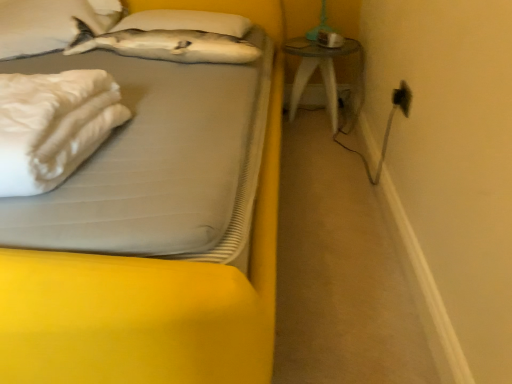
Question: Can you confirm if white matte pillow at upper left, which is counted as the 2th pillow, starting from the right, is smaller than white soft bed at upper left?

Choices:
 (A) no
 (B) yes

Answer: (B)

Question: Is white matte pillow at upper left, which is counted as the 2th pillow, starting from the right, taller than white soft bed at upper left?

Choices:
 (A) yes
 (B) no

Answer: (B)

Question: Would you say white soft bed at upper left is part of white matte pillow at upper left, marked as the 1th pillow in a left-to-right arrangement,'s contents?

Choices:
 (A) yes
 (B) no

Answer: (B)

Question: From a real-world perspective, is white matte pillow at upper left, marked as the 1th pillow in a left-to-right arrangement, physically above white soft bed at upper left?

Choices:
 (A) yes
 (B) no

Answer: (A)

Question: Is white matte pillow at upper left, marked as the 1th pillow in a left-to-right arrangement, wider than white soft bed at upper left?

Choices:
 (A) yes
 (B) no

Answer: (B)

Question: Is white matte pillow at upper left, which is counted as the 2th pillow, starting from the right, behind white soft bed at upper left?

Choices:
 (A) no
 (B) yes

Answer: (B)

Question: Are white matte pillow at upper left, which is counted as the 2th pillow, starting from the right, and white soft pillow at upper center, marked as the 1th pillow in a right-to-left arrangement, far apart?

Choices:
 (A) yes
 (B) no

Answer: (B)

Question: Does white matte pillow at upper left, which is counted as the 2th pillow, starting from the right, have a smaller size compared to white soft pillow at upper center, marked as the 1th pillow in a right-to-left arrangement?

Choices:
 (A) yes
 (B) no

Answer: (B)

Question: Considering the relative positions of white matte pillow at upper left, marked as the 1th pillow in a left-to-right arrangement, and white soft pillow at upper center, marked as the 1th pillow in a right-to-left arrangement, in the image provided, is white matte pillow at upper left, marked as the 1th pillow in a left-to-right arrangement, in front of white soft pillow at upper center, marked as the 1th pillow in a right-to-left arrangement,?

Choices:
 (A) no
 (B) yes

Answer: (B)

Question: From a real-world perspective, does white matte pillow at upper left, marked as the 1th pillow in a left-to-right arrangement, sit lower than white soft pillow at upper center, which is the second pillow from left to right?

Choices:
 (A) yes
 (B) no

Answer: (B)

Question: Can you confirm if white matte pillow at upper left, which is counted as the 2th pillow, starting from the right, is thinner than white soft pillow at upper center, which is the second pillow from left to right?

Choices:
 (A) no
 (B) yes

Answer: (B)

Question: Does white matte pillow at upper left, which is counted as the 2th pillow, starting from the right, appear on the left side of white soft pillow at upper center, which is the second pillow from left to right?

Choices:
 (A) yes
 (B) no

Answer: (A)

Question: Can you confirm if black plastic electric outlet at upper right is positioned to the right of transparent glass table at right?

Choices:
 (A) no
 (B) yes

Answer: (B)